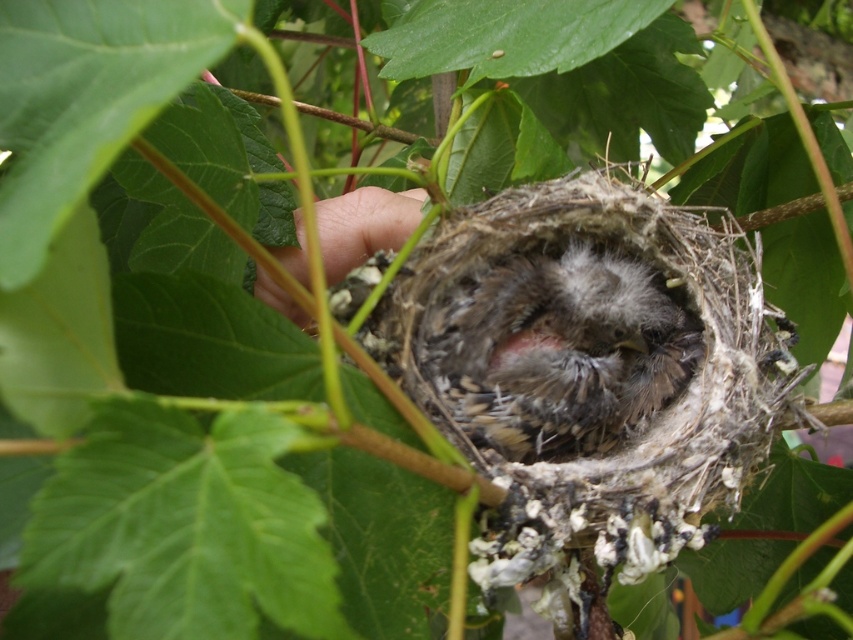
Can you confirm if soft brown feathers at center is smaller than fuzzy skin at center?

No, soft brown feathers at center is not smaller than fuzzy skin at center.

Can you confirm if soft brown feathers at center is shorter than fuzzy skin at center?

Incorrect, soft brown feathers at center's height does not fall short of fuzzy skin at center's.

Is point (502, 387) behind point (352, 248)?

That is False.

In order to click on soft brown feathers at center in this screenshot , I will do `click(555, 349)`.